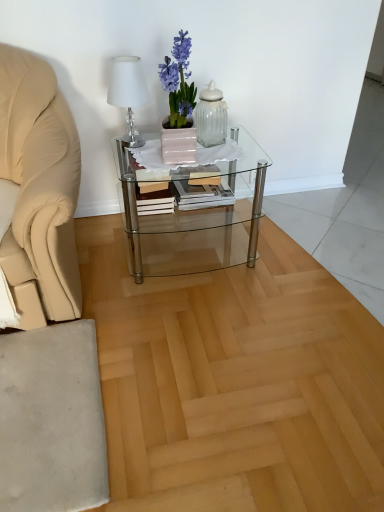
Question: Is wooden book at center in front of or behind clear glass coffee table at center in the image?

Choices:
 (A) front
 (B) behind

Answer: (B)

Question: Would you say wooden book at center is inside or outside clear glass coffee table at center?

Choices:
 (A) inside
 (B) outside

Answer: (A)

Question: Estimate the real-world distances between objects in this image. Which object is closer to the clear glass coffee table at center?

Choices:
 (A) wooden book at center
 (B) clear glass jar at center
 (C) white fabric lampshade at upper left

Answer: (A)

Question: Estimate the real-world distances between objects in this image. Which object is farther from the clear glass coffee table at center?

Choices:
 (A) clear glass jar at center
 (B) wooden book at center
 (C) white fabric lampshade at upper left

Answer: (C)